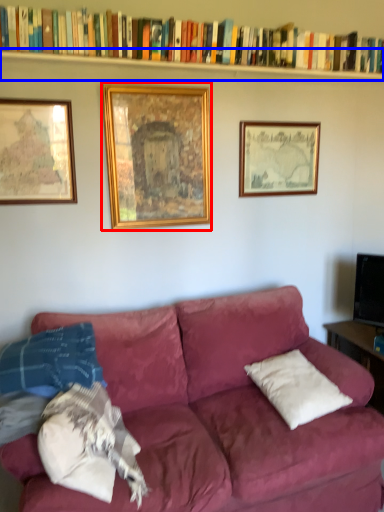
Question: Among these objects, which one is farthest to the camera, picture frame (highlighted by a red box) or shelf (highlighted by a blue box)?

Choices:
 (A) picture frame
 (B) shelf

Answer: (A)